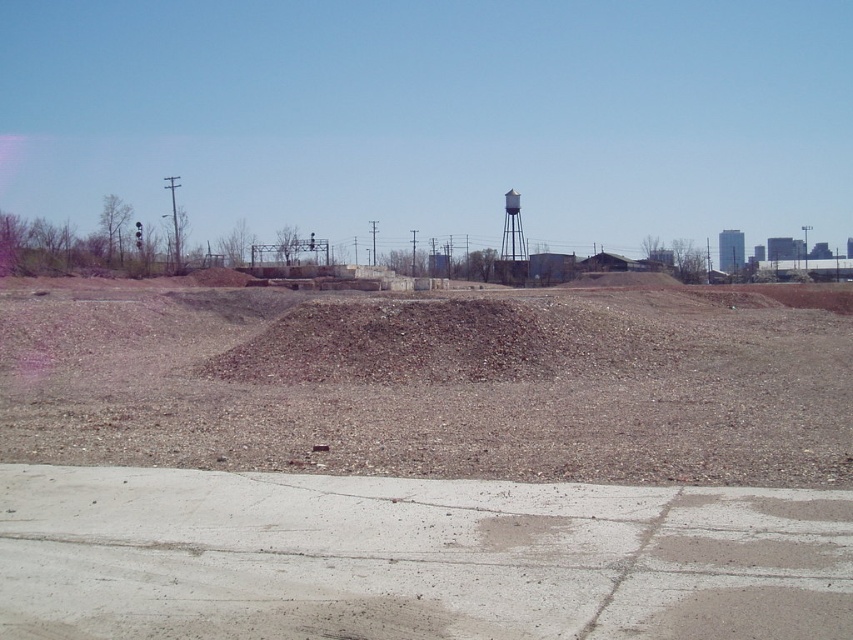
Question: Which point is farther to the camera?

Choices:
 (A) gray concrete dirt track at lower center
 (B) white painted metal water tower at upper center
 (C) brown gravel at center

Answer: (B)

Question: Can you confirm if brown gravel at center is smaller than gray concrete dirt track at lower center?

Choices:
 (A) no
 (B) yes

Answer: (A)

Question: Which of the following is the farthest from the observer?

Choices:
 (A) white painted metal water tower at upper center
 (B) gray concrete dirt track at lower center
 (C) brown gravel at center

Answer: (A)

Question: Does brown gravel at center have a lesser width compared to white painted metal water tower at upper center?

Choices:
 (A) yes
 (B) no

Answer: (B)

Question: Which point is farther to the camera?

Choices:
 (A) (369, 500)
 (B) (521, 259)
 (C) (7, 316)

Answer: (B)

Question: Can you confirm if gray concrete dirt track at lower center is smaller than white painted metal water tower at upper center?

Choices:
 (A) yes
 (B) no

Answer: (A)